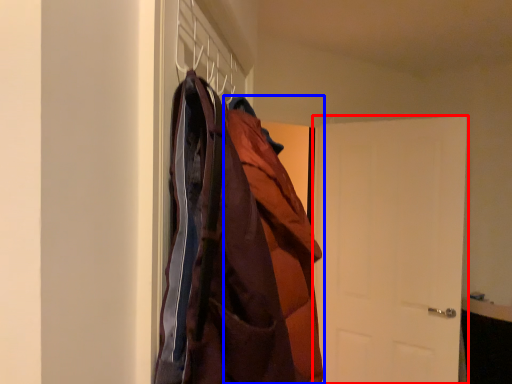
Question: Among these objects, which one is nearest to the camera, door (highlighted by a red box) or cloak (highlighted by a blue box)?

Choices:
 (A) door
 (B) cloak

Answer: (B)